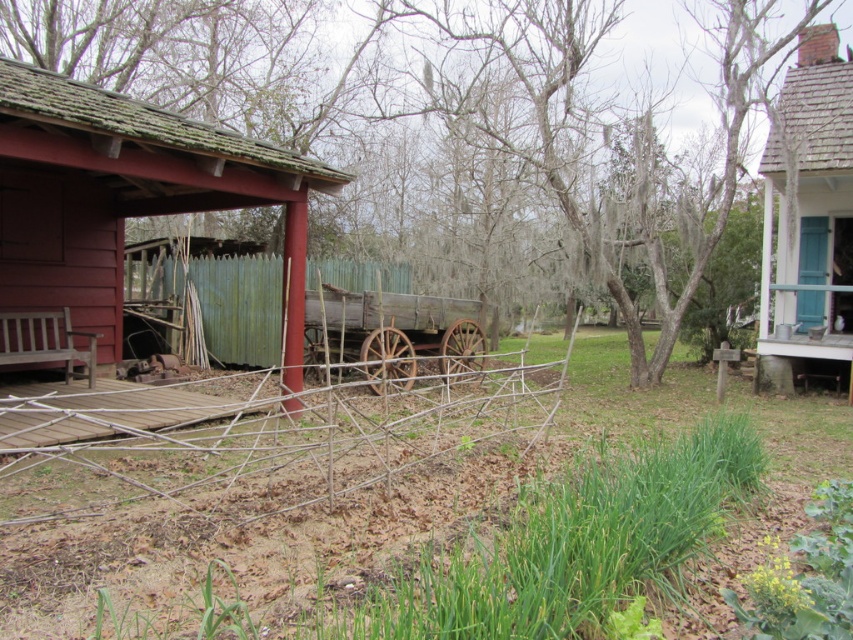
Between matte red wooden hut at left and green corrugated metal fence at center, which one has more height?

Standing taller between the two is matte red wooden hut at left.

Between point (117, 172) and point (355, 289), which one is positioned behind?

Point (355, 289)

Locate an element on the screen. Image resolution: width=853 pixels, height=640 pixels. matte red wooden hut at left is located at coordinates (123, 193).

I want to click on matte red wooden hut at left, so click(x=123, y=193).

Is matte red wooden hut at left smaller than rusty wood wagon at center?

Yes.

This screenshot has width=853, height=640. In order to click on matte red wooden hut at left in this screenshot , I will do `click(123, 193)`.

Locate an element on the screen. Image resolution: width=853 pixels, height=640 pixels. matte red wooden hut at left is located at coordinates (123, 193).

Which is more to the left, wooden fence at center or matte red wooden hut at left?

matte red wooden hut at left

Is wooden fence at center bigger than matte red wooden hut at left?

Yes, wooden fence at center is bigger than matte red wooden hut at left.

Locate an element on the screen. This screenshot has height=640, width=853. wooden fence at center is located at coordinates (387, 512).

Where is `wooden fence at center`? The image size is (853, 640). wooden fence at center is located at coordinates (387, 512).